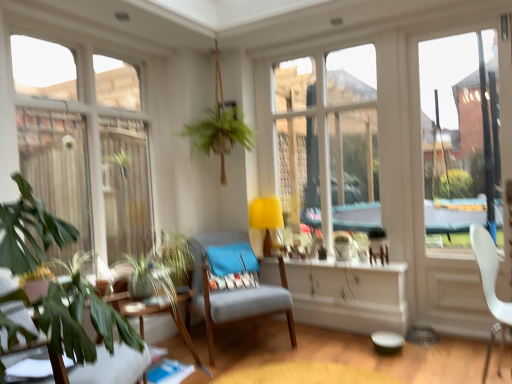
At what (x,y) coordinates should I click in order to perform the action: click on free space to the back side of white plastic chair at right, which is the 2th chair from back to front. Please return your answer as a coordinate pair (x, y). Looking at the image, I should click on click(x=465, y=361).